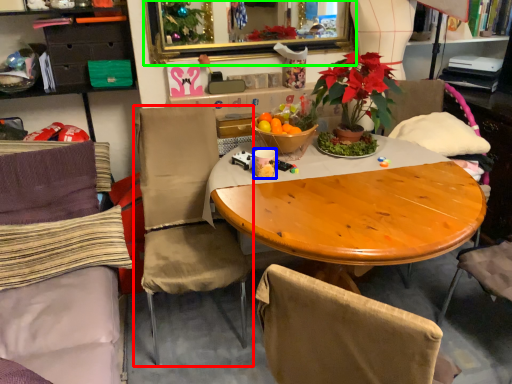
Question: Which object is the farthest from chair (highlighted by a red box)? Choose among these: coffee cup (highlighted by a blue box) or mirror (highlighted by a green box).

Choices:
 (A) coffee cup
 (B) mirror

Answer: (B)